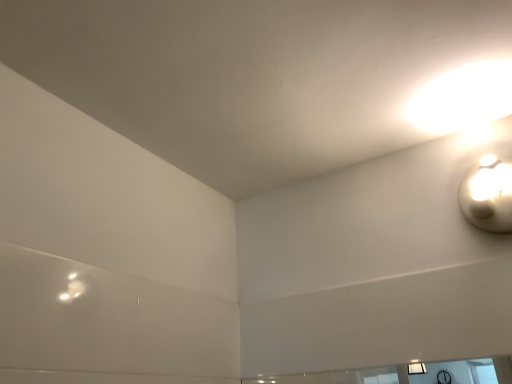
Question: Should I look upward or downward to see matte white lamp at upper right?

Choices:
 (A) up
 (B) down

Answer: (B)